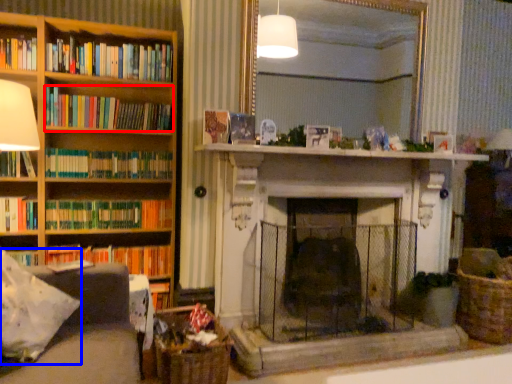
Question: Which object appears closest to the camera in this image, book (highlighted by a red box) or pillow (highlighted by a blue box)?

Choices:
 (A) book
 (B) pillow

Answer: (B)